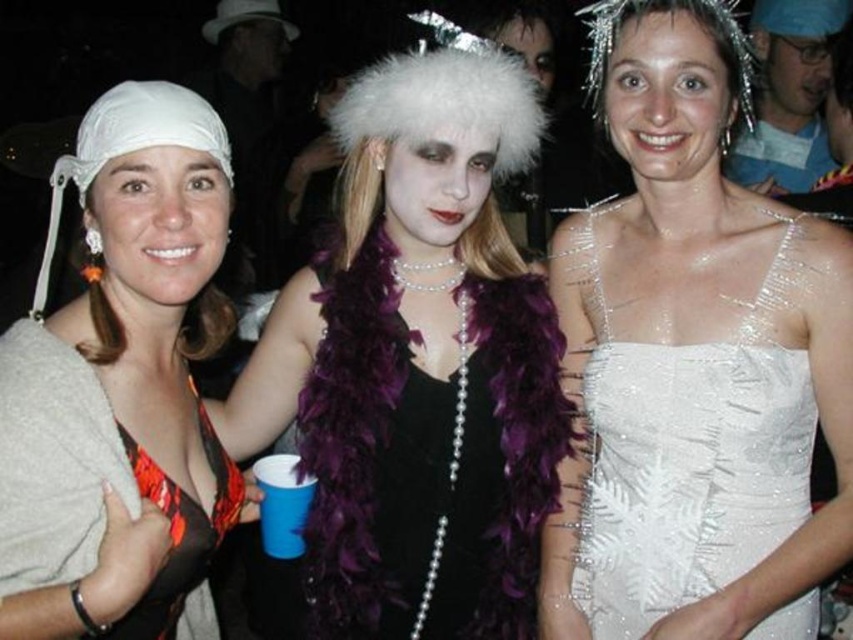
Is white sequined dress at center in front of purple feather boa at center?

Yes, it is.

Between white sequined dress at center and purple feather boa at center, which one is positioned lower?

purple feather boa at center is lower down.

Who is more distant from viewer, [718,74] or [538,124]?

Point [538,124]

Find the location of a particular element. Image resolution: width=853 pixels, height=640 pixels. white sequined dress at center is located at coordinates (694, 362).

Is purple feather boa at center wider than orange printed fabric bikini top at left?

Yes.

Which is more to the left, purple feather boa at center or orange printed fabric bikini top at left?

From the viewer's perspective, orange printed fabric bikini top at left appears more on the left side.

This screenshot has width=853, height=640. Identify the location of purple feather boa at center. (416, 369).

The height and width of the screenshot is (640, 853). Find the location of `purple feather boa at center`. purple feather boa at center is located at coordinates (416, 369).

Who is higher up, white sequined dress at center or orange printed fabric bikini top at left?

Positioned higher is white sequined dress at center.

Which is more to the left, white sequined dress at center or orange printed fabric bikini top at left?

orange printed fabric bikini top at left

Between point (676, 588) and point (115, 330), which one is positioned behind?

Point (676, 588)

I want to click on white sequined dress at center, so click(x=694, y=362).